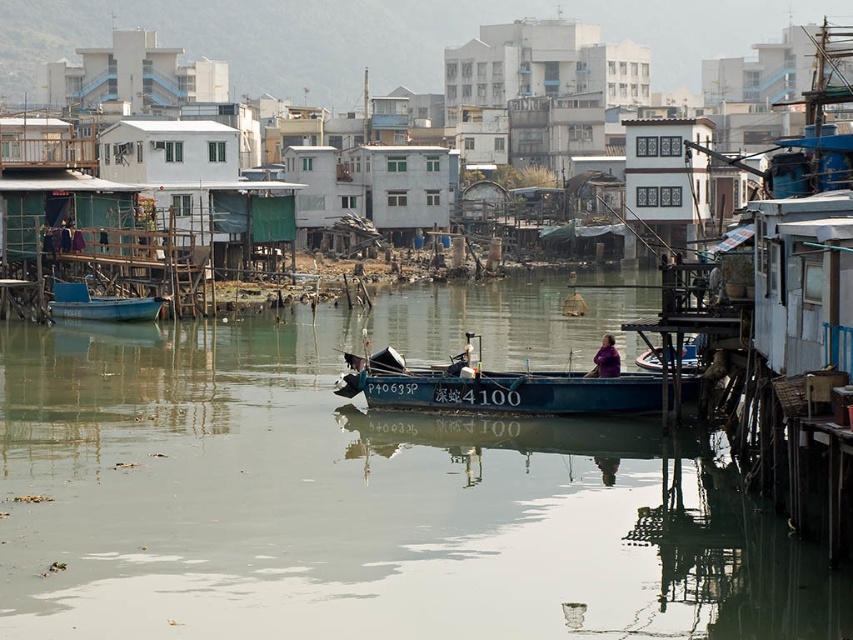
The image size is (853, 640). I want to click on blue matte boat at center, so click(x=494, y=387).

Is point (386, 387) positioned after point (70, 301)?

No, it is not.

Which is in front, point (575, 406) or point (64, 317)?

Positioned in front is point (575, 406).

The height and width of the screenshot is (640, 853). Identify the location of blue matte boat at center. (494, 387).

Between clear water at center and purple fabric at center, which one appears on the right side from the viewer's perspective?

From the viewer's perspective, purple fabric at center appears more on the right side.

Is point (260, 372) behind point (616, 353)?

Yes, it is.

The image size is (853, 640). Describe the element at coordinates (368, 492) in the screenshot. I see `clear water at center` at that location.

Locate an element on the screen. clear water at center is located at coordinates (368, 492).

Does blue matte boat at center have a lesser width compared to purple fabric at center?

Indeed, blue matte boat at center has a lesser width compared to purple fabric at center.

Is point (497, 390) positioned before point (601, 340)?

Yes.

The image size is (853, 640). Find the location of `blue matte boat at center`. blue matte boat at center is located at coordinates (494, 387).